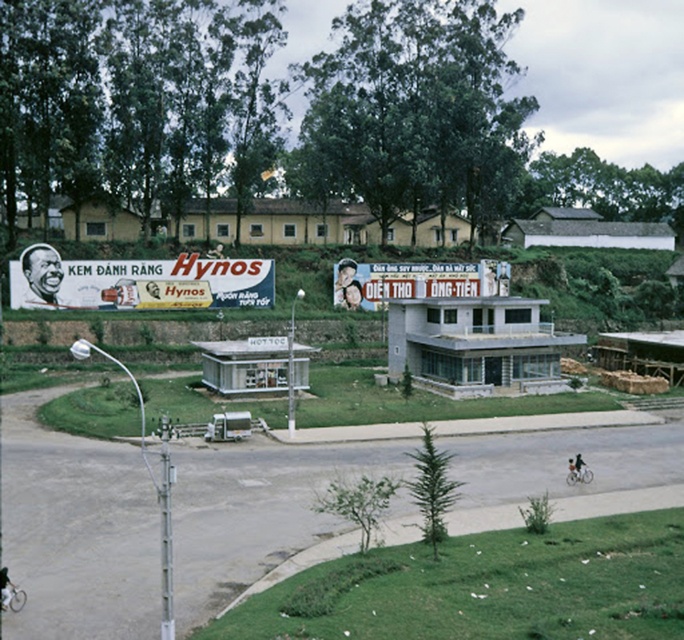
You are a delivery person trying to locate a shop based on a map. The map shows two billboards. The first is a matte yellow billboard at left and the second is a matte plastic billboard at center. According to the map, which billboard should you look for first if you are approaching from the direction of the road?

The matte yellow billboard at left should be looked for first since it is located below the matte plastic billboard at center, meaning it is closer to the road level and visible earlier when approaching.

You are a delivery driver approaching the road with a truck that has a height of 2.5 meters. The matte yellow billboard at left and the matte plastic billboard at center are both in your path. Which billboard will you hit first if you continue driving straight?

The matte yellow billboard at left is in front of the matte plastic billboard at center, so you will hit the matte yellow billboard at left first.